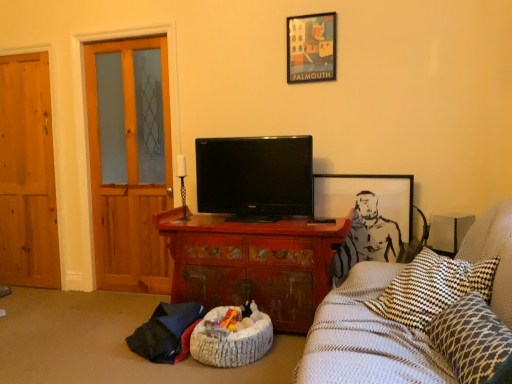
Question: Could you tell me if wooden door at left, the second door viewed from the right, is facing metallic framed poster at upper center, which is counted as the 2th picture frame, starting from the bottom?

Choices:
 (A) yes
 (B) no

Answer: (B)

Question: Can you confirm if wooden door at left, the second door viewed from the right, is taller than metallic framed poster at upper center, which is counted as the 2th picture frame, starting from the bottom?

Choices:
 (A) yes
 (B) no

Answer: (A)

Question: Can you confirm if wooden door at left, which is the 1th door in left-to-right order, is wider than metallic framed poster at upper center, which is counted as the 2th picture frame, starting from the bottom?

Choices:
 (A) no
 (B) yes

Answer: (B)

Question: Is metallic framed poster at upper center, which is counted as the 2th picture frame, starting from the bottom, at the back of wooden door at left, the second door viewed from the right?

Choices:
 (A) no
 (B) yes

Answer: (A)

Question: From the image's perspective, would you say wooden door at left, which is the 1th door in left-to-right order, is shown under metallic framed poster at upper center, which is counted as the 2th picture frame, starting from the bottom?

Choices:
 (A) no
 (B) yes

Answer: (B)

Question: Is the position of wooden door at left, the second door viewed from the right, more distant than that of metallic framed poster at upper center, which is counted as the 2th picture frame, starting from the bottom?

Choices:
 (A) no
 (B) yes

Answer: (B)

Question: Can you confirm if wooden door at left, the second door viewed from the right, is smaller than distressed wood cabinet at center?

Choices:
 (A) yes
 (B) no

Answer: (A)

Question: Is wooden door at left, which is the 1th door in left-to-right order, surrounding distressed wood cabinet at center?

Choices:
 (A) yes
 (B) no

Answer: (B)

Question: From the image's perspective, is wooden door at left, which is the 1th door in left-to-right order, above distressed wood cabinet at center?

Choices:
 (A) yes
 (B) no

Answer: (A)

Question: Is there a large distance between wooden door at left, the second door viewed from the right, and distressed wood cabinet at center?

Choices:
 (A) no
 (B) yes

Answer: (B)

Question: Does wooden door at left, the second door viewed from the right, come in front of distressed wood cabinet at center?

Choices:
 (A) yes
 (B) no

Answer: (B)

Question: From the image's perspective, is wooden door at left, the second door viewed from the right, under distressed wood cabinet at center?

Choices:
 (A) yes
 (B) no

Answer: (B)

Question: Is gray paper picture frame at upper right, which is the first picture frame from bottom to top, closer to the viewer compared to leopard print cushion at lower right?

Choices:
 (A) yes
 (B) no

Answer: (B)